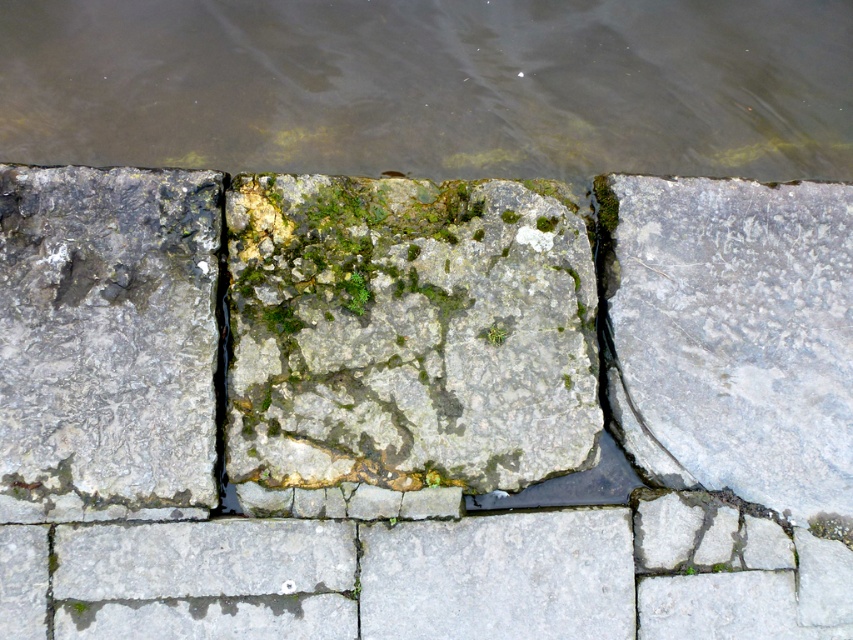
You are standing on the gray rough stone at right and want to move to the gray stone at center. Which direction should you move to reach it?

The gray stone at center is to the left of the gray rough stone at right, so you should move to the left to reach it.

You are standing on the stone pavement near the water and see the point marked at coordinates (408,333). What type of stone is located at that point?

The point at (408,333) marks a gray rough stone at center.